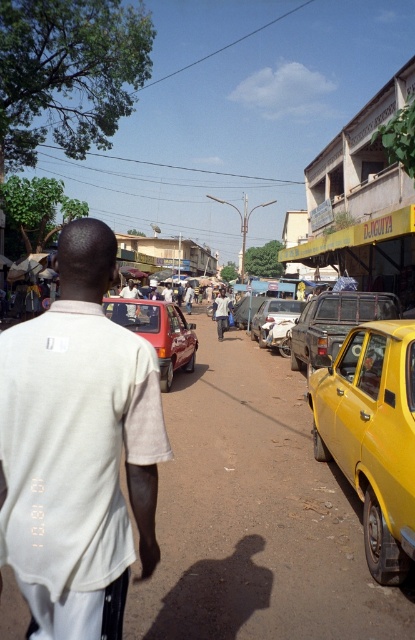
Question: Where is rusty metal car at center located in relation to metallic silver car at center in the image?

Choices:
 (A) left
 (B) right

Answer: (B)

Question: Among these objects, which one is nearest to the camera?

Choices:
 (A) matte black pickup truck at center
 (B) yellow matte taxi at right
 (C) rusty metal car at center
 (D) matte red car at center

Answer: (B)

Question: Can you confirm if yellow matte taxi at right is thinner than matte black car at center?

Choices:
 (A) yes
 (B) no

Answer: (A)

Question: Which object is positioned closest to the matte black pickup truck at center?

Choices:
 (A) matte red car at center
 (B) white cotton shirt at center

Answer: (A)

Question: Does matte black pickup truck at center have a larger size compared to matte black car at center?

Choices:
 (A) no
 (B) yes

Answer: (A)

Question: Which object is closer to the camera taking this photo?

Choices:
 (A) matte black car at center
 (B) rusty metal car at center
 (C) matte red car at center

Answer: (C)